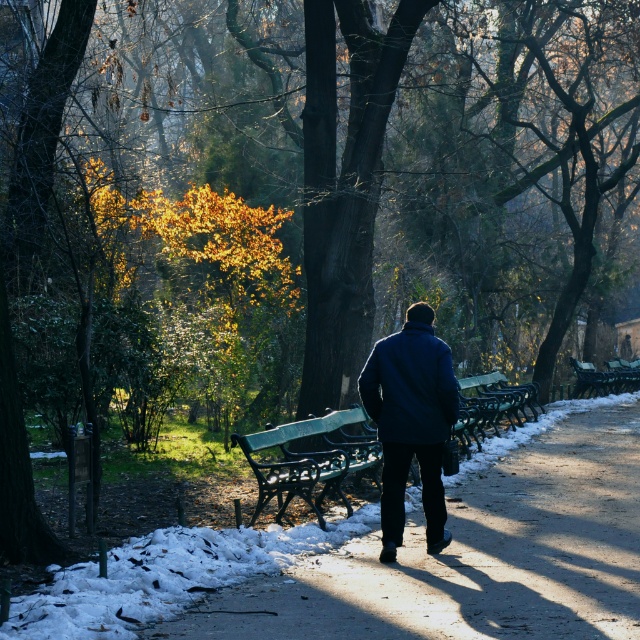
Question: Which of the following is the closest to the observer?

Choices:
 (A) green painted metal bench at center
 (B) green polished wood bench at center-right
 (C) green wooden bench at center

Answer: (C)

Question: Is dark blue coat at center below green painted wood bench at center?

Choices:
 (A) yes
 (B) no

Answer: (B)

Question: Can you confirm if green painted metal bench at center is bigger than green polished wood bench at center-right?

Choices:
 (A) yes
 (B) no

Answer: (B)

Question: Which of the following is the closest to the observer?

Choices:
 (A) green polished wood bench at center-right
 (B) dark blue coat at center
 (C) green painted wood bench at center

Answer: (B)

Question: Based on their relative distances, which object is farther from the green painted wood bench at center?

Choices:
 (A) green painted metal bench at center
 (B) green polished wood bench at center-right
 (C) dark blue coat at center

Answer: (C)

Question: Does dark blue coat at center have a smaller size compared to green polished wood bench at center-right?

Choices:
 (A) no
 (B) yes

Answer: (B)